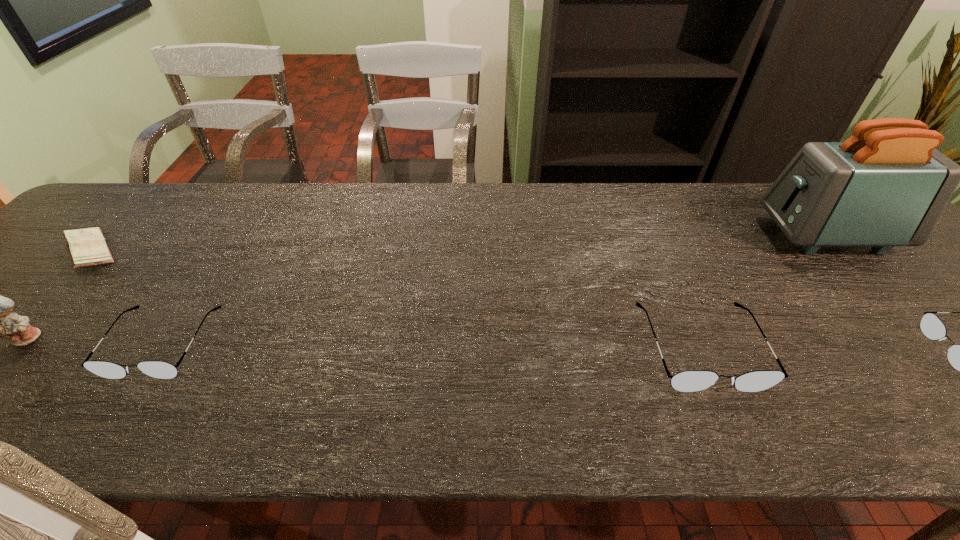
To achieve uniform spacing by inserting another spectacles among them, please point to a free space for this new spectacles. Please provide its 2D coordinates. Your answer should be formatted as a tuple, i.e. [(x, y)], where the tuple contains the x and y coordinates of a point satisfying the conditions above.

[(430, 346)]